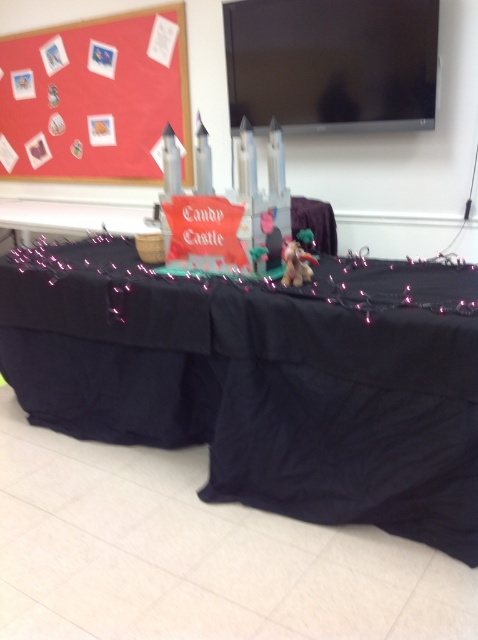
You are planning to place a new decorative item on the table. The red matte bulletin board at upper left is currently on the left side of the black fabric table at center. If you want to move the bulletin board to the right side of the table, which direction should you move it?

The red matte bulletin board at upper left is currently on the left side of the black fabric table at center. To move it to the right side of the table, you should move it to the right side of the black fabric table at center.

You are standing at the point marked by the coordinates point (x=10, y=58) and want to walk towards the point marked by the coordinates point (x=31, y=332). Which direction should you move?

You should move forward because point (x=31, y=332) is in front of point (x=10, y=58).